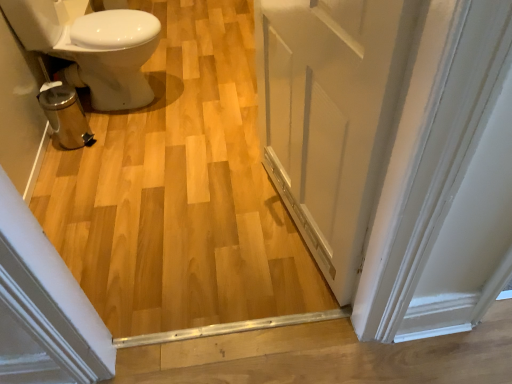
The width and height of the screenshot is (512, 384). What are the coordinates of `free space that is in between white painted wood door at center and white glossy bidet at left` in the screenshot? It's located at (201, 160).